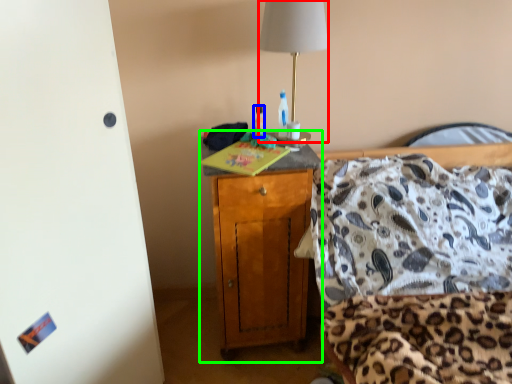
Question: Which is farther away from lamp (highlighted by a red box)? bottle (highlighted by a blue box) or cabinetry (highlighted by a green box)?

Choices:
 (A) bottle
 (B) cabinetry

Answer: (B)